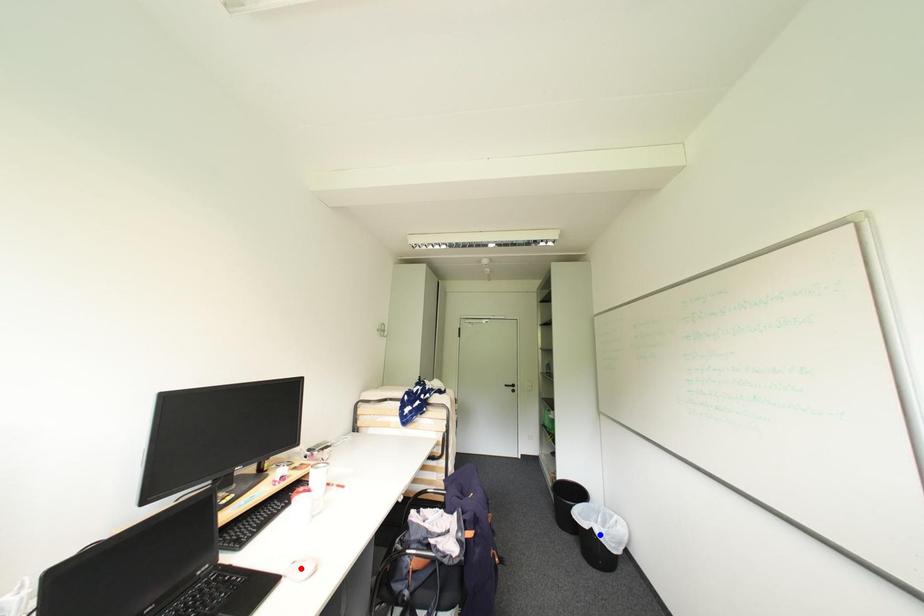
Question: Which of the two points in the image is closer to the camera?

Choices:
 (A) Blue point is closer.
 (B) Red point is closer.

Answer: (B)